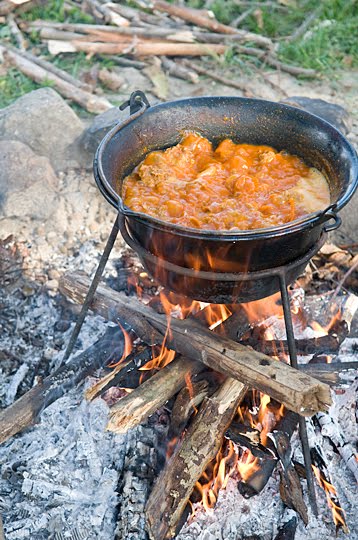
Where is `stand`? This screenshot has width=358, height=540. stand is located at coordinates [283, 297].